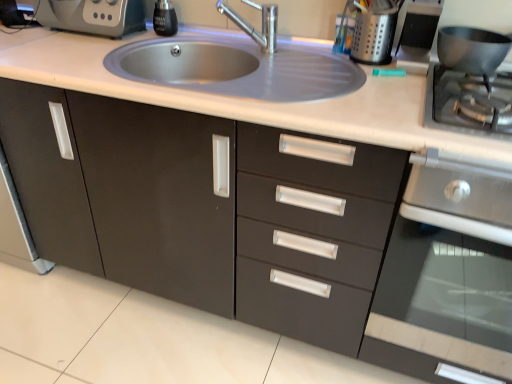
The width and height of the screenshot is (512, 384). What are the coordinates of `vacant area on the back side of polished chrome faucet at upper center` in the screenshot? It's located at (240, 45).